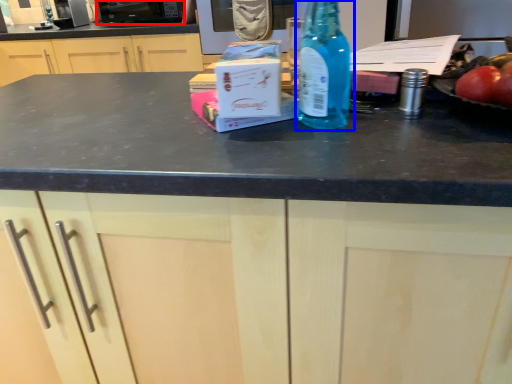
Question: Which of the following is the closest to the observer, appliance (highlighted by a red box) or bottle (highlighted by a blue box)?

Choices:
 (A) appliance
 (B) bottle

Answer: (B)